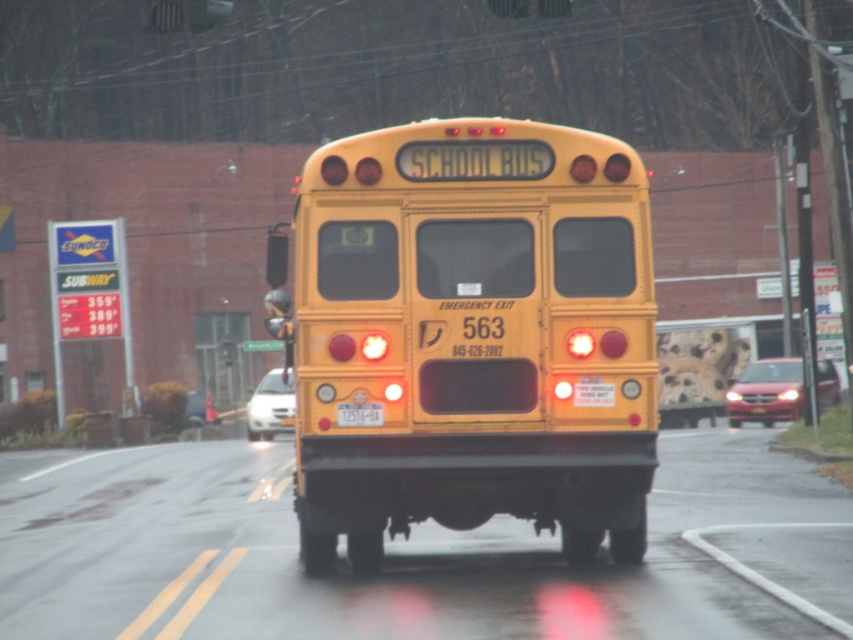
Image resolution: width=853 pixels, height=640 pixels. Describe the element at coordinates (469, 336) in the screenshot. I see `yellow matte/solid school bus at center` at that location.

Can you confirm if yellow matte/solid school bus at center is smaller than yellow matte license plate at center?

No.

Is point (514, 342) farther from viewer compared to point (369, 403)?

Yes, it is behind point (369, 403).

Where is `yellow matte/solid school bus at center`? yellow matte/solid school bus at center is located at coordinates (469, 336).